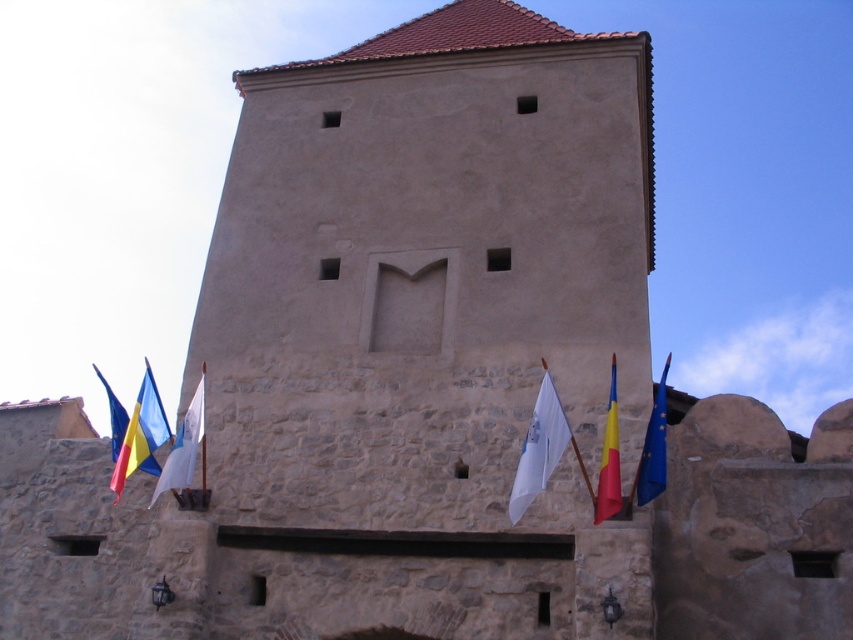
You are a tourist standing in front of the historic stone tower. You see a blue fabric flag at right located at point (653, 448). Can you confirm if this flag is positioned at the specified coordinates?

Yes, the blue fabric flag at right is indeed located at point (653, 448) as described.

You are a tourist standing in front of the historic stone tower. You see the blue fabric flag at right and the white fabric flag at center. Which flag is taller?

The blue fabric flag at right is taller than the white fabric flag at center.